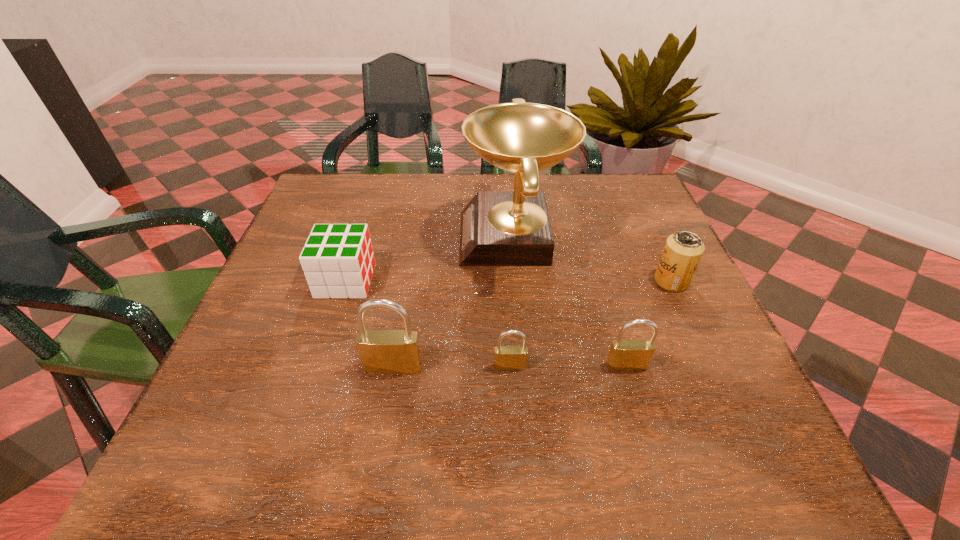
Locate an element on the screen. Image resolution: width=960 pixels, height=540 pixels. free space at the near edge of the desktop is located at coordinates (641, 403).

The width and height of the screenshot is (960, 540). In the image, there is a desktop. What are the coordinates of `vacant space at the left edge` in the screenshot? It's located at (302, 279).

I want to click on vacant point at the right edge, so click(627, 273).

Find the location of a particular element. Image resolution: width=960 pixels, height=540 pixels. blank space at the far left corner of the desktop is located at coordinates (316, 215).

In the image, there is a desktop. Where is `vacant space at the far right corner`? vacant space at the far right corner is located at coordinates (610, 200).

The width and height of the screenshot is (960, 540). In the image, there is a desktop. What are the coordinates of `vacant area at the near right corner` in the screenshot? It's located at (752, 403).

At what (x,y) coordinates should I click in order to perform the action: click on free space between the shortest padlock and the fifth object from left to right. Please return your answer as a coordinate pair (x, y). Image resolution: width=960 pixels, height=540 pixels. Looking at the image, I should click on (568, 366).

Locate an element on the screen. This screenshot has width=960, height=540. vacant area that lies between the rightmost object and the second padlock from right to left is located at coordinates (590, 324).

Locate an element on the screen. vacant region between the beer can and the cube is located at coordinates (509, 281).

Locate an element on the screen. Image resolution: width=960 pixels, height=540 pixels. vacant area that lies between the fifth object from left to right and the leftmost object is located at coordinates (486, 323).